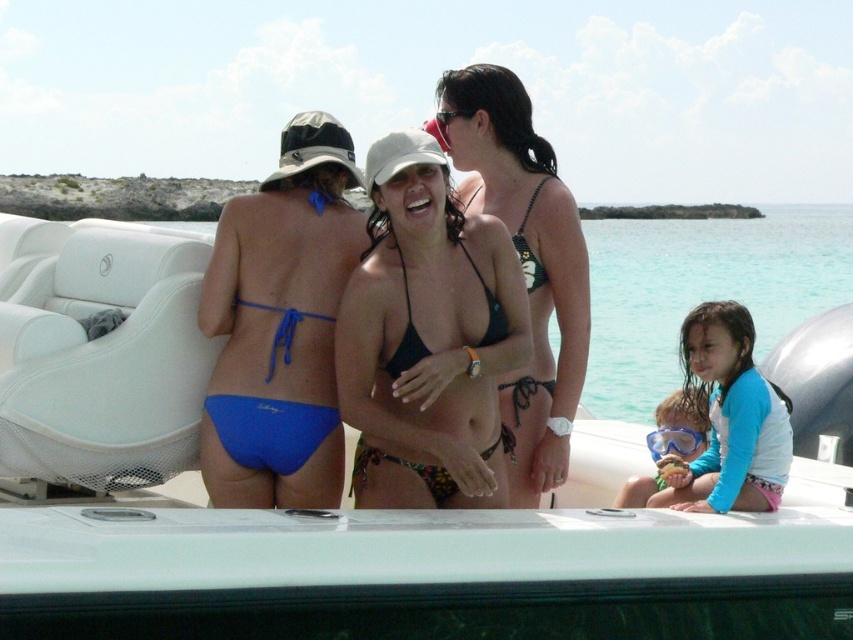
Question: Observing the image, what is the correct spatial positioning of black matte bikini at center in reference to clear plastic goggles at center?

Choices:
 (A) above
 (B) below

Answer: (B)

Question: Is the position of blue fabric bikini bottom at left less distant than that of blue rubber snorkel mask at lower center?

Choices:
 (A) no
 (B) yes

Answer: (B)

Question: Which of the following is the farthest from the observer?

Choices:
 (A) (541, 260)
 (B) (302, 465)
 (C) (439, 115)

Answer: (C)

Question: Which point is farther to the camera?

Choices:
 (A) blue rubber snorkel mask at lower center
 (B) clear plastic goggles at center
 (C) transparent plastic goggles at lower right

Answer: (C)

Question: Is blue fabric bikini bottom at left thinner than blue rubber snorkel mask at lower center?

Choices:
 (A) yes
 (B) no

Answer: (B)

Question: Which of the following is the closest to the observer?

Choices:
 (A) (451, 112)
 (B) (281, 468)

Answer: (B)